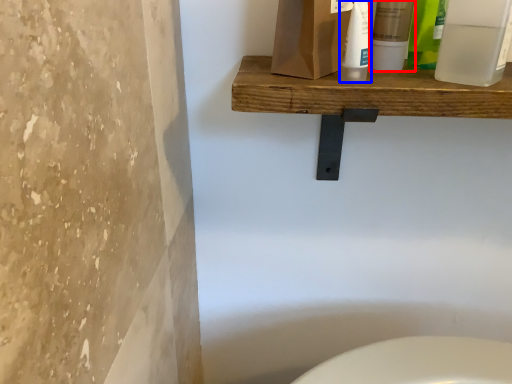
Question: Which object appears closest to the camera in this image, mouthwash (highlighted by a red box) or cleaning product (highlighted by a blue box)?

Choices:
 (A) mouthwash
 (B) cleaning product

Answer: (B)